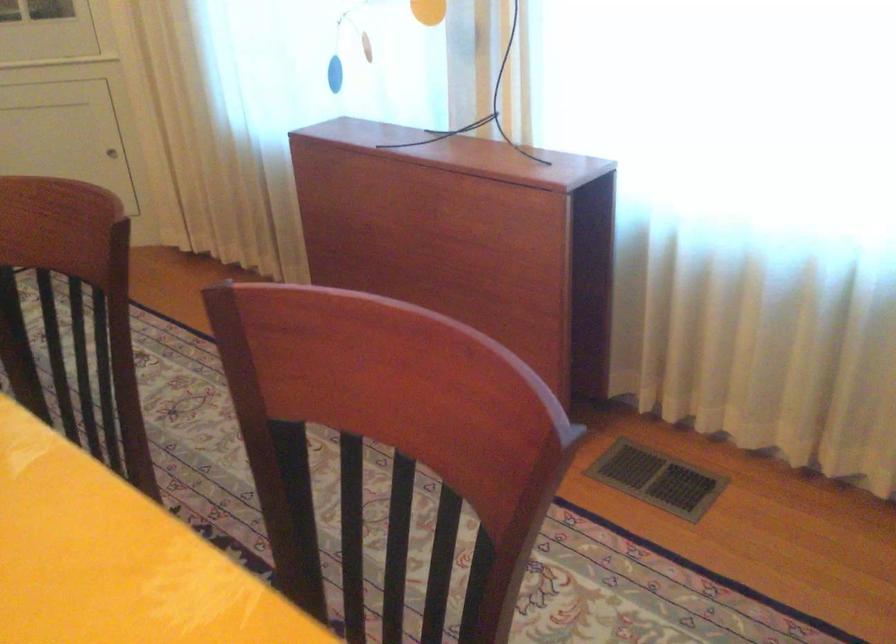
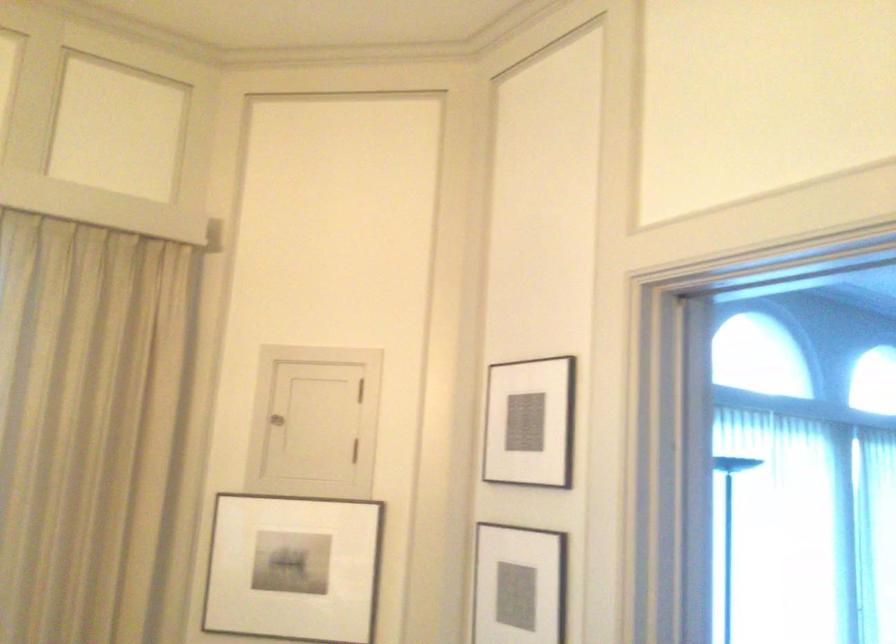
The first image is from the beginning of the video and the second image is from the end. How did the camera likely rotate when shooting the video?

The camera's rotation is toward right-up.